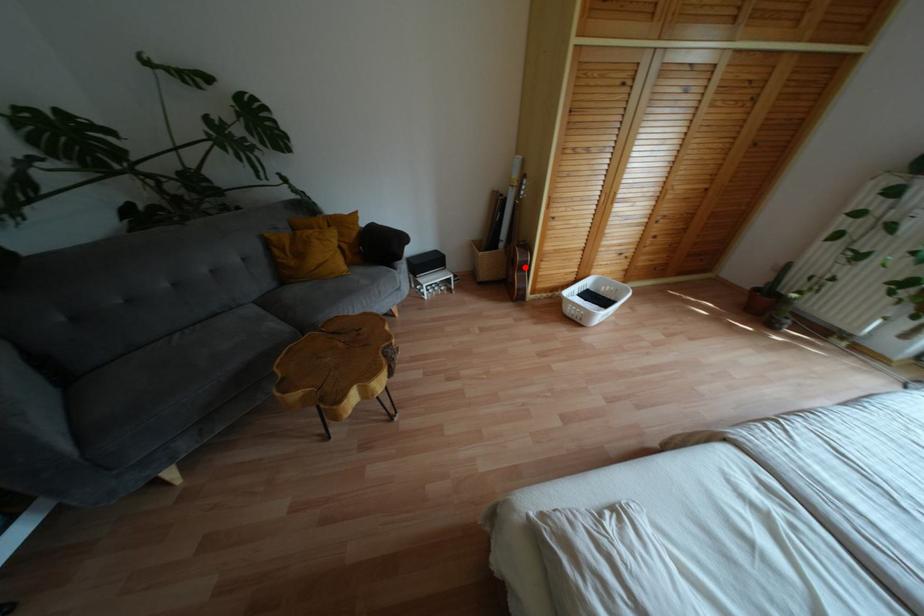
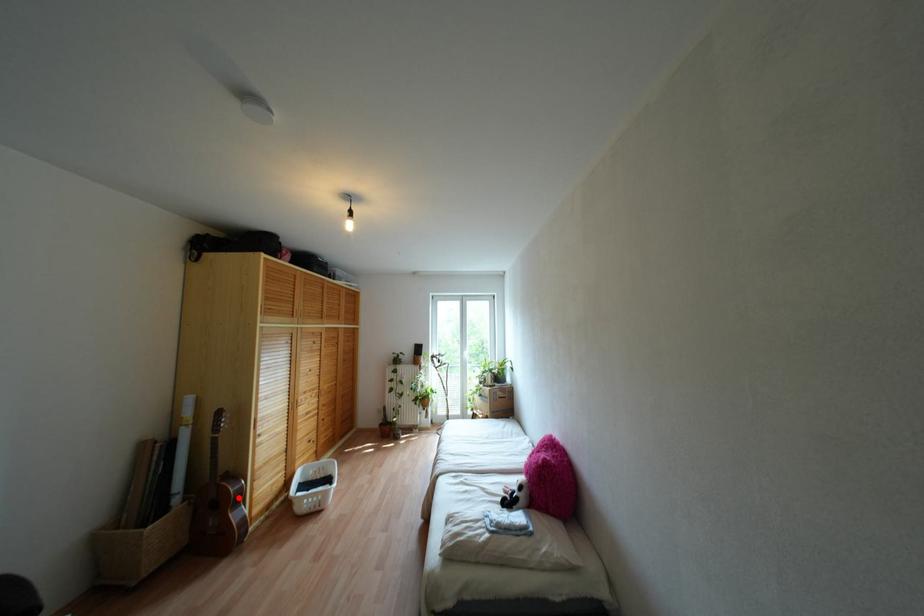
I am providing you with two images of the same scene from different viewpoints. A red point is marked on the first image and another point is marked on the second image. Do the highlighted points in image1 and image2 indicate the same real-world spot?

Yes